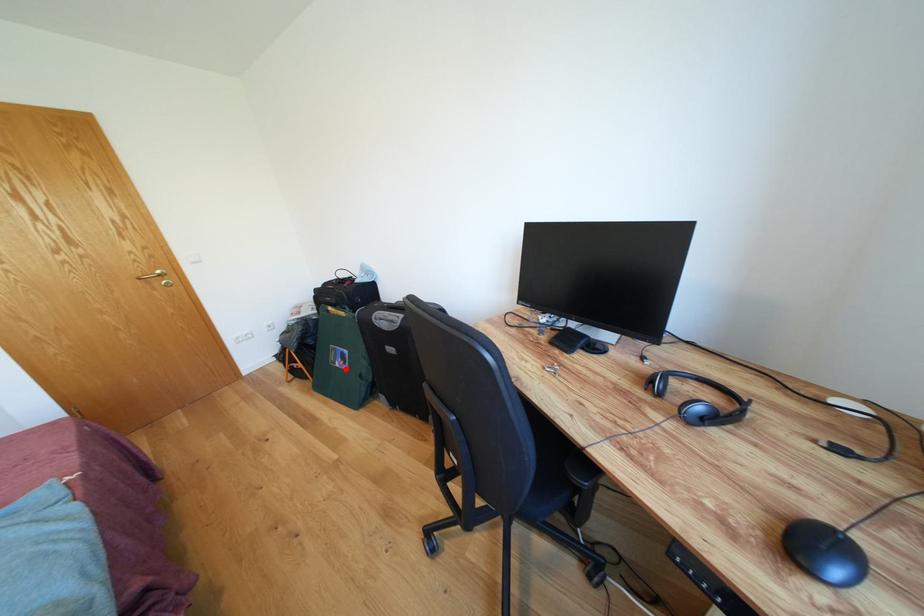
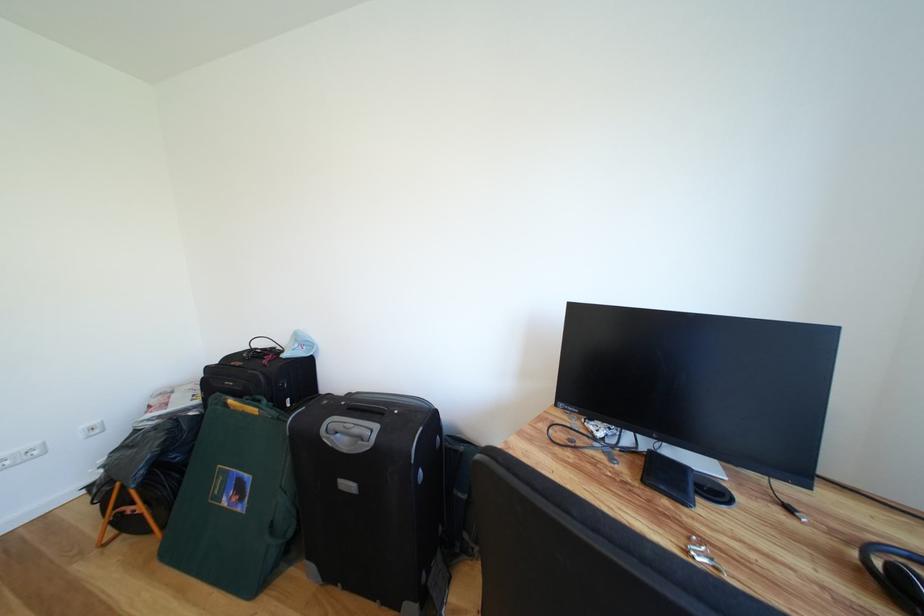
Question: I am providing you with two images of the same scene from different viewpoints. Image1 has a red point marked. In image2, the corresponding 3D location appears at what relative position? Reply with the corresponding letter.

Choices:
 (A) Closer
 (B) Farther

Answer: (A)